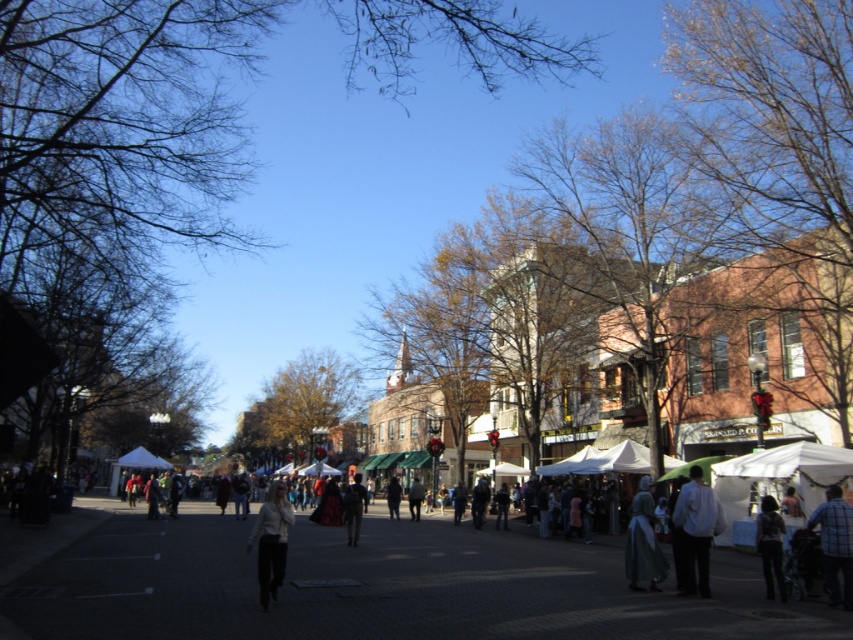
You are a photographer positioned at the edge of the cobblestone street in the town square. You want to capture a photo of both the white matte pants at center and the white fabric canopy at center. Based on their positions, which object should you adjust your camera to focus on first to ensure both are in the frame?

The white matte pants at center are to the right of the white fabric canopy at center, so you should focus on the white fabric canopy at center first to ensure both are in the frame.

You are standing in the town square and see both the white matte pants at center and the white fabric canopy at center. Which object is nearer to you?

The white matte pants at center is closer to the viewer than the white fabric canopy at center.

You are a photographer standing in the cobblestone street and want to take a photo of the white matte pants at center and the denim jacket at lower right. Which object should you zoom in on to capture both in the frame without moving the camera?

Since the white matte pants at center is taller than the denim jacket at lower right, you should zoom in on the white matte pants at center to ensure both are captured in the frame without moving the camera.